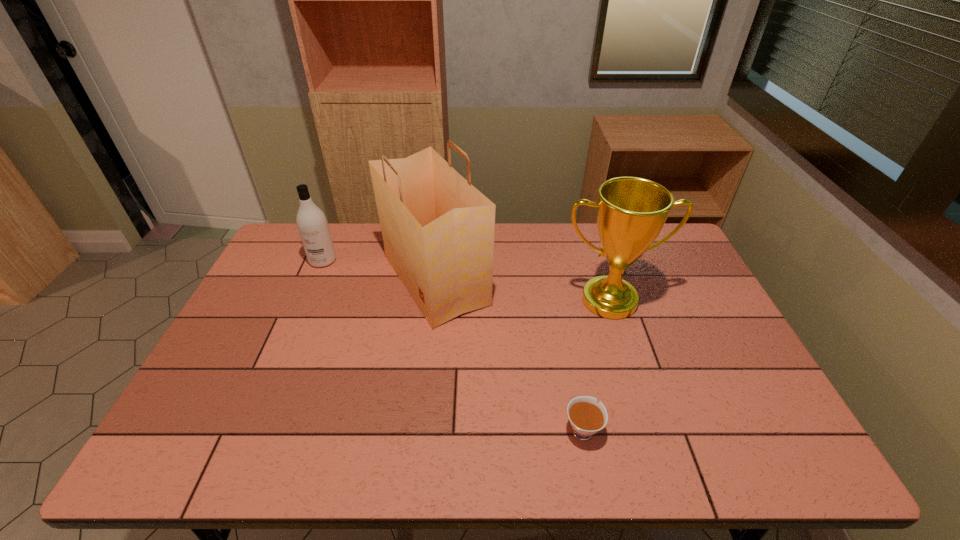
Where is `vacant space situated 0.250m on the side of the nearest object with the handle`? The width and height of the screenshot is (960, 540). vacant space situated 0.250m on the side of the nearest object with the handle is located at coordinates (564, 332).

The height and width of the screenshot is (540, 960). Identify the location of free space located on the side of the nearest object with the handle. (568, 360).

Identify the location of grocery bag that is at the far edge. (438, 230).

Identify the location of shampoo at the far edge. (313, 228).

At what (x,y) coordinates should I click in order to perform the action: click on object at the near edge. Please return your answer as a coordinate pair (x, y). The width and height of the screenshot is (960, 540). Looking at the image, I should click on (587, 417).

This screenshot has width=960, height=540. Identify the location of object located at the left edge. (313, 228).

The height and width of the screenshot is (540, 960). Identify the location of object that is at the right edge. (631, 212).

Where is `object present at the far left corner`? The height and width of the screenshot is (540, 960). object present at the far left corner is located at coordinates (313, 228).

Locate an element on the screen. The image size is (960, 540). vacant space at the far edge is located at coordinates (578, 259).

The height and width of the screenshot is (540, 960). Find the location of `vacant space at the near edge of the desktop`. vacant space at the near edge of the desktop is located at coordinates (616, 453).